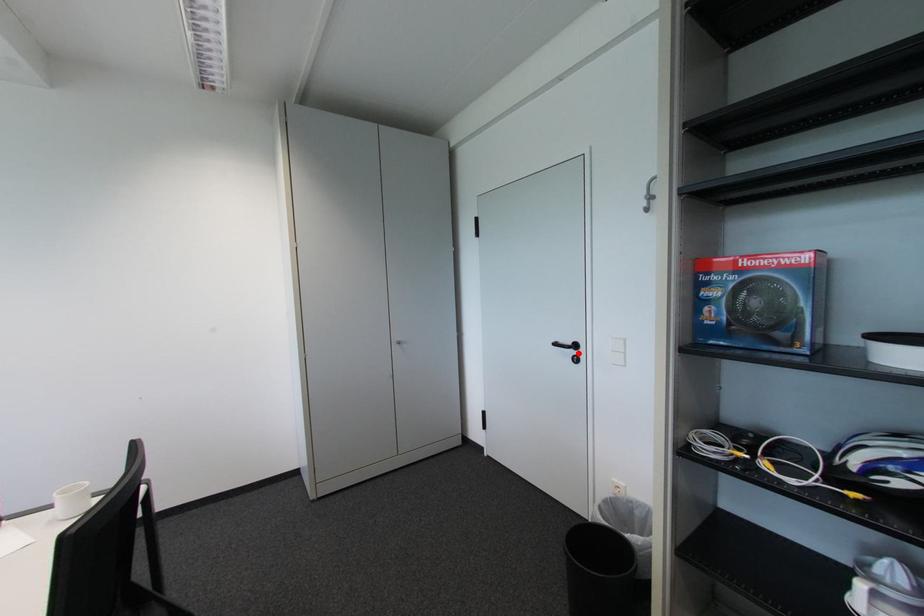
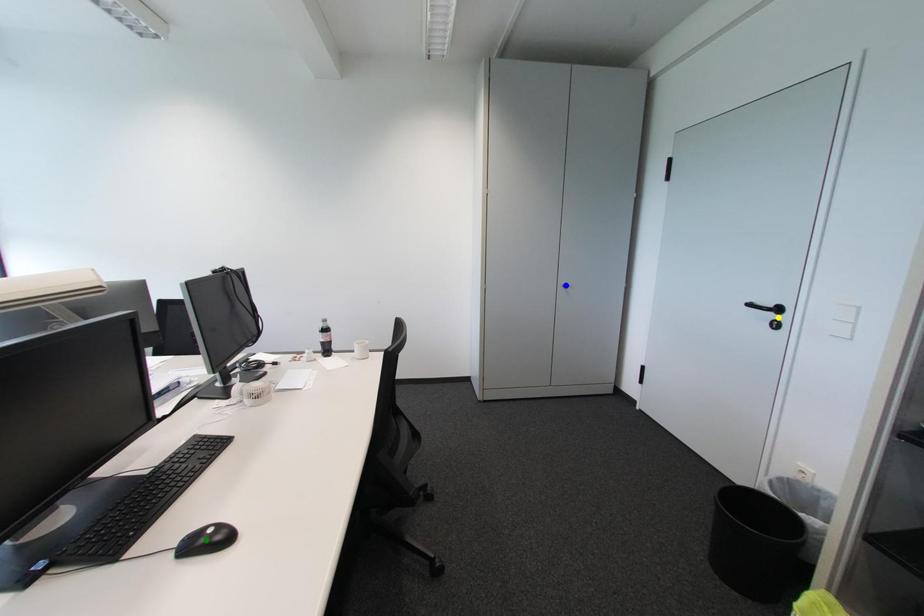
Question: I am providing you with two images of the same scene from different viewpoints. A red point is marked on the first image. You are given multiple points on the second image. Which point in image 2 represents the same 3d spot as the red point in image 1?

Choices:
 (A) yellow point
 (B) blue point
 (C) green point

Answer: (A)